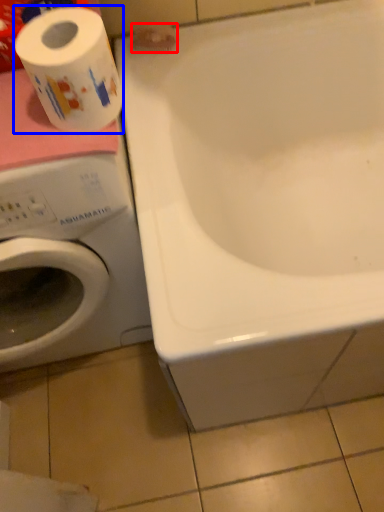
Question: Which object is closer to the camera taking this photo, toilet paper (highlighted by a red box) or toilet paper (highlighted by a blue box)?

Choices:
 (A) toilet paper
 (B) toilet paper

Answer: (B)